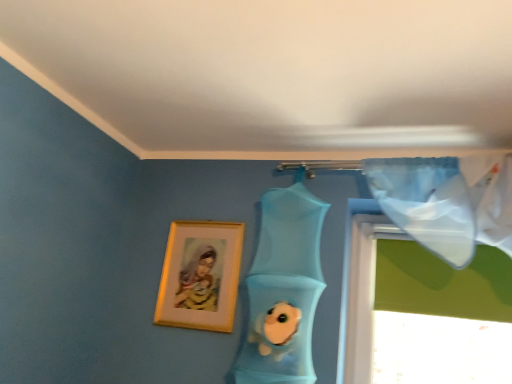
You are a GUI agent. You are given a task and a screenshot of the screen. Output one action in this format:
    pyautogui.click(x=<x>, y=<y>)
    Task: Click on the gold wooden picture frame at upper center
    The height and width of the screenshot is (384, 512).
    Given the screenshot: What is the action you would take?
    pyautogui.click(x=200, y=275)

The width and height of the screenshot is (512, 384). What do you see at coordinates (200, 275) in the screenshot?
I see `gold wooden picture frame at upper center` at bounding box center [200, 275].

The width and height of the screenshot is (512, 384). In order to click on gold wooden picture frame at upper center in this screenshot , I will do `click(200, 275)`.